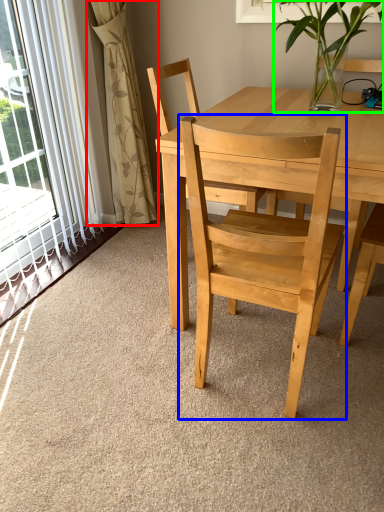
Question: Considering the real-world distances, which object is closest to curtain (highlighted by a red box)? chair (highlighted by a blue box) or houseplant (highlighted by a green box).

Choices:
 (A) chair
 (B) houseplant

Answer: (B)